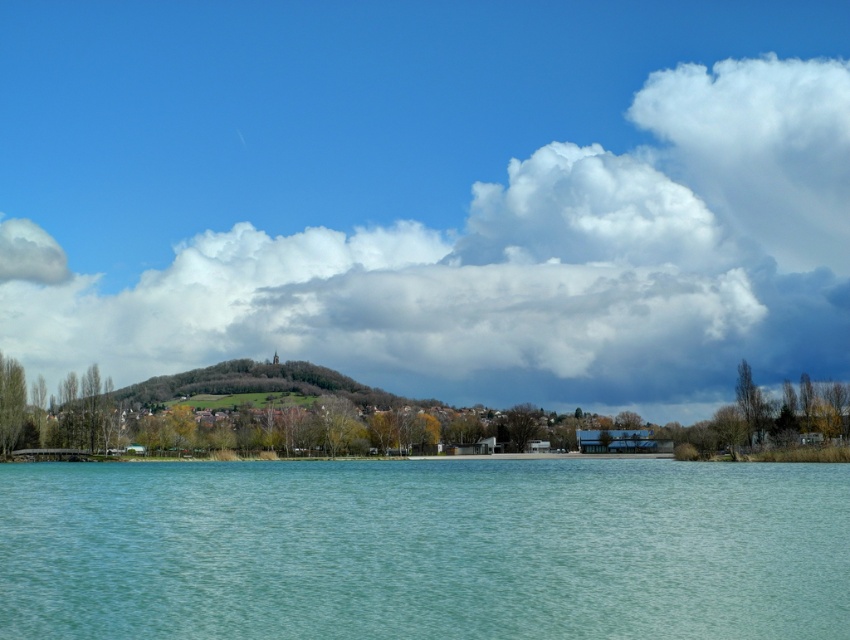
Question: Is white fluffy cloud at upper center thinner than clear water at center?

Choices:
 (A) no
 (B) yes

Answer: (A)

Question: Is white fluffy cloud at upper center smaller than clear water at center?

Choices:
 (A) no
 (B) yes

Answer: (A)

Question: Which object is closer to the camera taking this photo?

Choices:
 (A) clear water at center
 (B) white fluffy cloud at upper center

Answer: (A)

Question: Is white fluffy cloud at upper center in front of clear water at center?

Choices:
 (A) yes
 (B) no

Answer: (B)